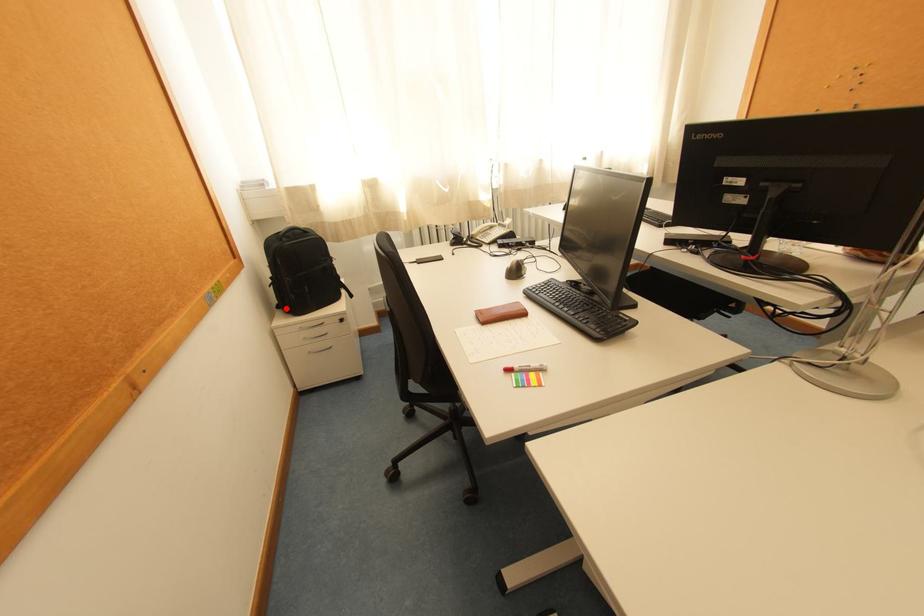
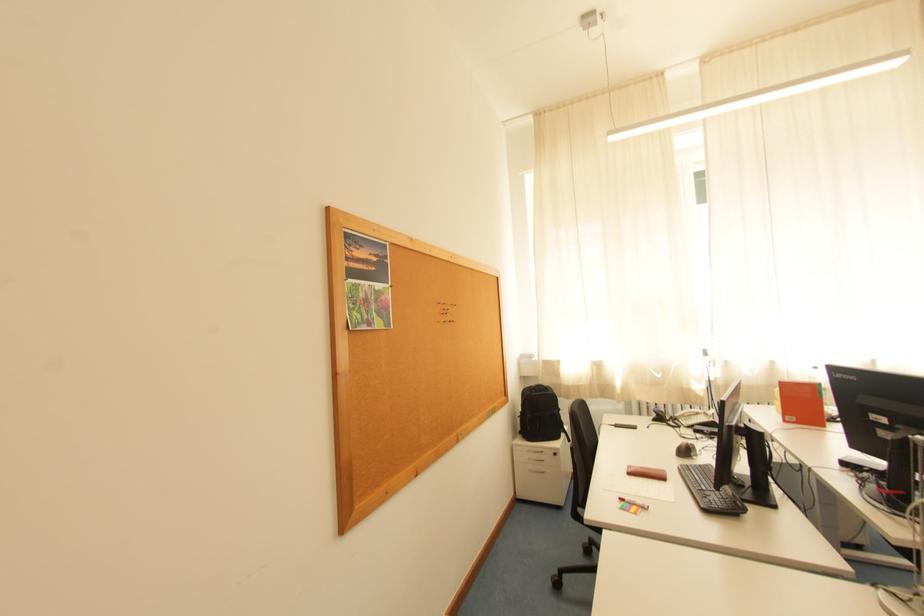
Find the pixel in the second image that matches the highlighted location in the first image.

(528, 434)